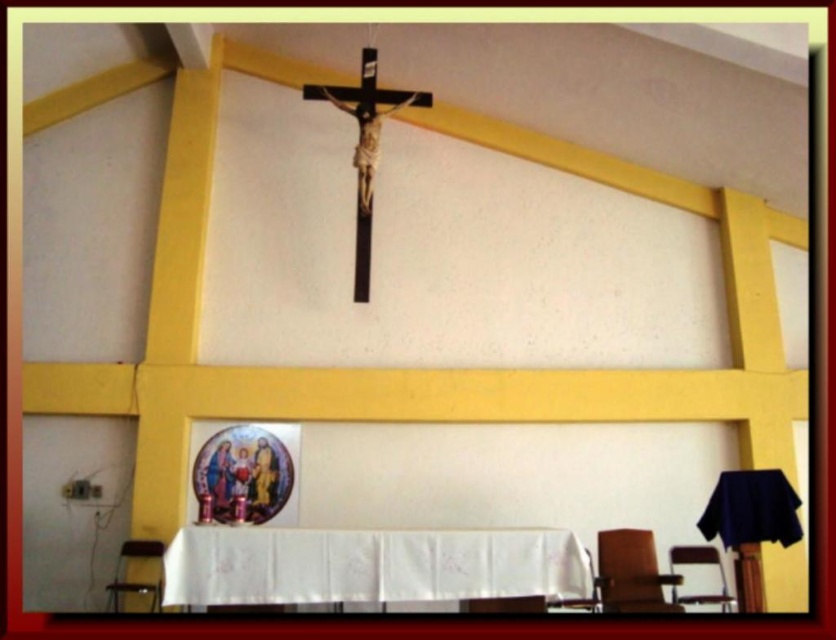
You are a person who is 1.7 meters tall and wants to sit in the church. You see the metallic silver chair at lower right and the brown wooden chair at lower center. Which chair is closer to the table with the crucifix?

The brown wooden chair at lower center is closer to the table with the crucifix because it is positioned closer to the center of the room compared to the metallic silver chair at lower right.